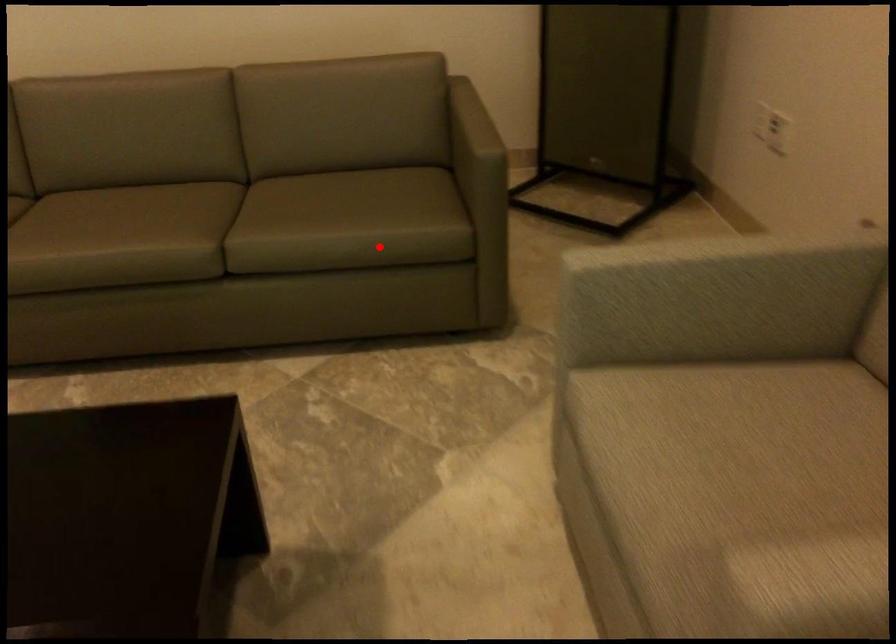
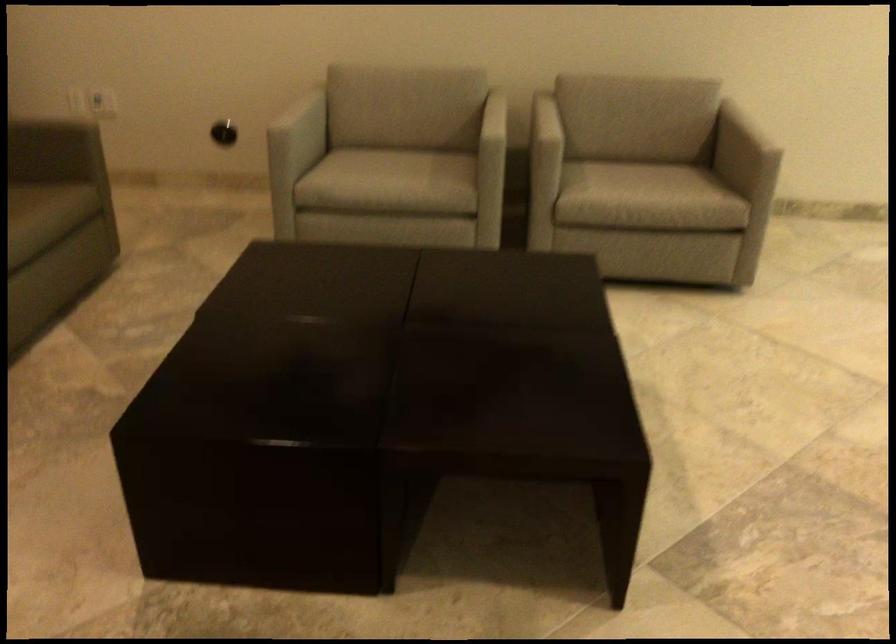
Question: A red point is marked in image1. In image2, is the corresponding 3D point closer to the camera or farther? Reply with the corresponding letter.

Choices:
 (A) The corresponding 3D point is closer.
 (B) The corresponding 3D point is farther.

Answer: (B)